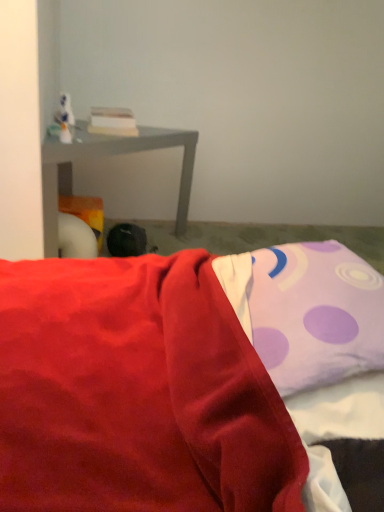
Question: Is purple dotted pillow at upper right to the left of black fabric bean bag at center from the viewer's perspective?

Choices:
 (A) no
 (B) yes

Answer: (A)

Question: Can you confirm if purple dotted pillow at upper right is bigger than black fabric bean bag at center?

Choices:
 (A) no
 (B) yes

Answer: (B)

Question: Considering the relative sizes of purple dotted pillow at upper right and black fabric bean bag at center in the image provided, is purple dotted pillow at upper right smaller than black fabric bean bag at center?

Choices:
 (A) yes
 (B) no

Answer: (B)

Question: Does purple dotted pillow at upper right have a lesser width compared to black fabric bean bag at center?

Choices:
 (A) yes
 (B) no

Answer: (B)

Question: From a real-world perspective, is purple dotted pillow at upper right on top of black fabric bean bag at center?

Choices:
 (A) no
 (B) yes

Answer: (B)

Question: From the image's perspective, is purple dotted pillow at upper right located beneath black fabric bean bag at center?

Choices:
 (A) no
 (B) yes

Answer: (B)

Question: Is matte gray table at left smaller than purple dotted pillow at upper right?

Choices:
 (A) no
 (B) yes

Answer: (A)

Question: Does matte gray table at left come behind purple dotted pillow at upper right?

Choices:
 (A) no
 (B) yes

Answer: (B)

Question: Considering the relative positions of matte gray table at left and purple dotted pillow at upper right in the image provided, is matte gray table at left to the left of purple dotted pillow at upper right from the viewer's perspective?

Choices:
 (A) yes
 (B) no

Answer: (A)

Question: Is matte gray table at left closer to the viewer compared to purple dotted pillow at upper right?

Choices:
 (A) yes
 (B) no

Answer: (B)

Question: From a real-world perspective, is matte gray table at left physically below purple dotted pillow at upper right?

Choices:
 (A) no
 (B) yes

Answer: (B)

Question: From a real-world perspective, is matte gray table at left physically above purple dotted pillow at upper right?

Choices:
 (A) no
 (B) yes

Answer: (A)

Question: Can you confirm if matte gray table at left is thinner than black fabric bean bag at center?

Choices:
 (A) no
 (B) yes

Answer: (A)